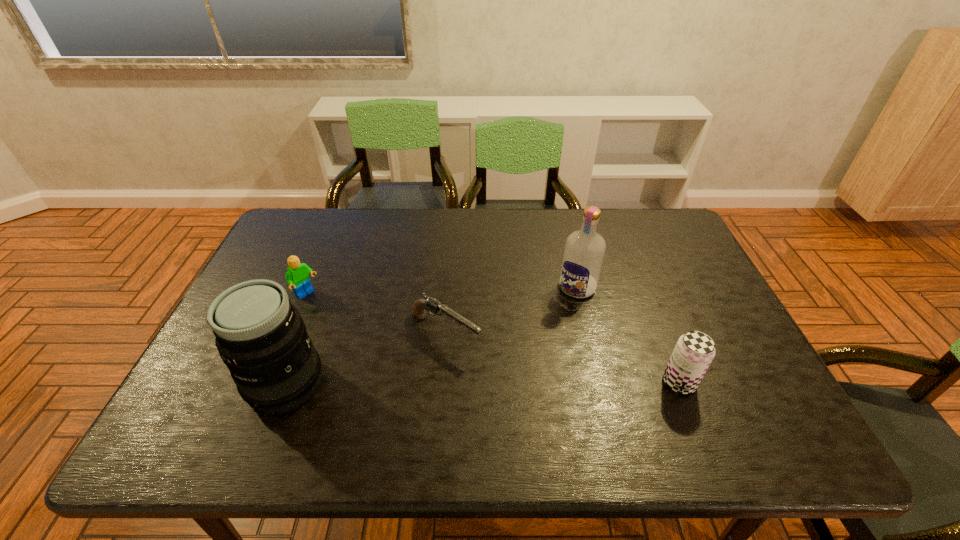
Locate an element on the screen. Lego present at the left edge is located at coordinates (297, 274).

Find the location of a particular element. object that is at the near left corner is located at coordinates (261, 337).

Where is `vacant space at the far edge`? This screenshot has height=540, width=960. vacant space at the far edge is located at coordinates (439, 214).

Locate an element on the screen. Image resolution: width=960 pixels, height=540 pixels. vacant area at the near edge is located at coordinates (406, 401).

At what (x,y) coordinates should I click in order to perform the action: click on vacant region at the near left corner. Please return your answer as a coordinate pair (x, y). Looking at the image, I should click on (234, 393).

Identify the location of vacant position at the near right corner of the desktop. The image size is (960, 540). (778, 411).

You are a GUI agent. You are given a task and a screenshot of the screen. Output one action in this format:
    pyautogui.click(x=<x>, y=<y>)
    Task: Click on the free space between the Lego and the gun
    The height and width of the screenshot is (540, 960).
    Given the screenshot: What is the action you would take?
    pyautogui.click(x=376, y=314)

Where is `vacant point located between the Lego and the gun`? Image resolution: width=960 pixels, height=540 pixels. vacant point located between the Lego and the gun is located at coordinates (376, 314).

Locate an element on the screen. free space between the telephoto lens and the shortest object is located at coordinates (366, 359).

Locate an element on the screen. This screenshot has width=960, height=540. free point between the gun and the telephoto lens is located at coordinates (366, 359).